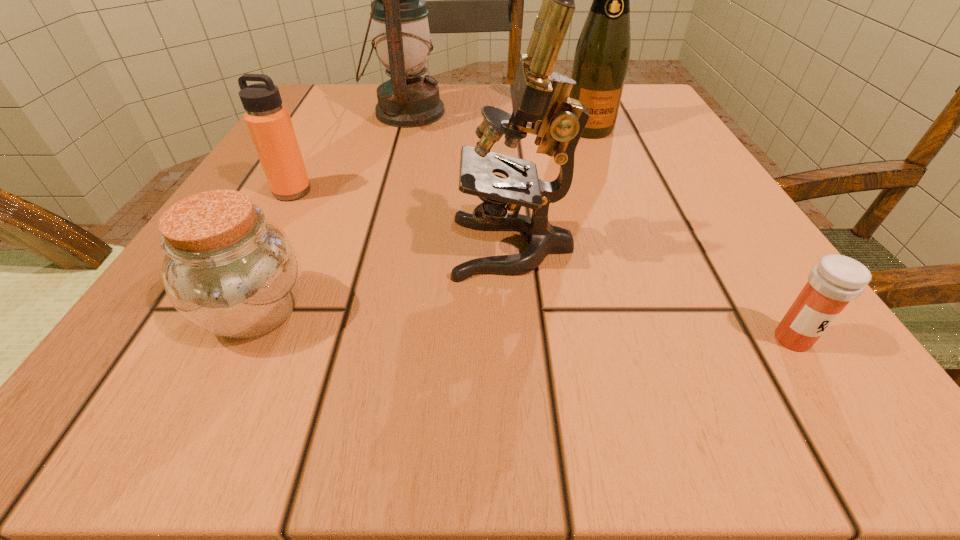
The image size is (960, 540). Find the location of `vacant region at the left edge`. vacant region at the left edge is located at coordinates (291, 328).

At what (x,y) coordinates should I click in order to perform the action: click on blank area at the right edge. Please return your answer as a coordinate pair (x, y). This screenshot has width=960, height=540. Looking at the image, I should click on (714, 232).

Find the location of a particular element. This screenshot has width=960, height=540. vacant space at the far left corner of the desktop is located at coordinates (306, 119).

I want to click on free space at the far right corner of the desktop, so click(643, 119).

Locate an element on the screen. Image resolution: width=960 pixels, height=540 pixels. free space between the jar and the fifth object from left to right is located at coordinates (422, 220).

The image size is (960, 540). In order to click on vacant area that lies between the third shortest object and the rightmost object in this screenshot , I will do pyautogui.click(x=542, y=265).

The image size is (960, 540). In order to click on empty space that is in between the shortest object and the oil lamp in this screenshot , I will do `click(599, 226)`.

I want to click on vacant space that is in between the oil lamp and the fifth tallest object, so click(331, 212).

At what (x,y) coordinates should I click in order to perform the action: click on vacant space that's between the shortest object and the fifth tallest object. Please return your answer as a coordinate pair (x, y). Looking at the image, I should click on (524, 325).

This screenshot has height=540, width=960. What are the coordinates of `free point between the microscope and the jar` in the screenshot? It's located at (385, 279).